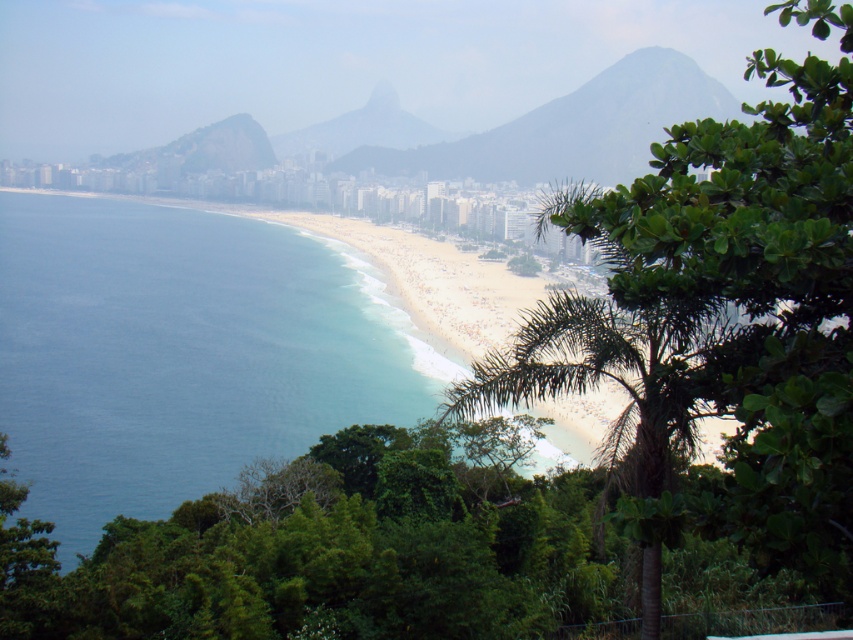
You are a photographer planning to capture the coastal view. You want to ensure that both the blue water at center and the gray rocky mountain at center are visible in your shot. Based on their positions, which object should you place closer to the left side of your camera frame?

The blue water at center should be placed closer to the left side of your camera frame since it is positioned to the left of the gray rocky mountain at center.

You are a photographer planning to capture the coastal view. You notice the blue water at center and the smooth gray rock at center. Which object appears taller in the photo?

The blue water at center appears taller than the smooth gray rock at center in the photo.